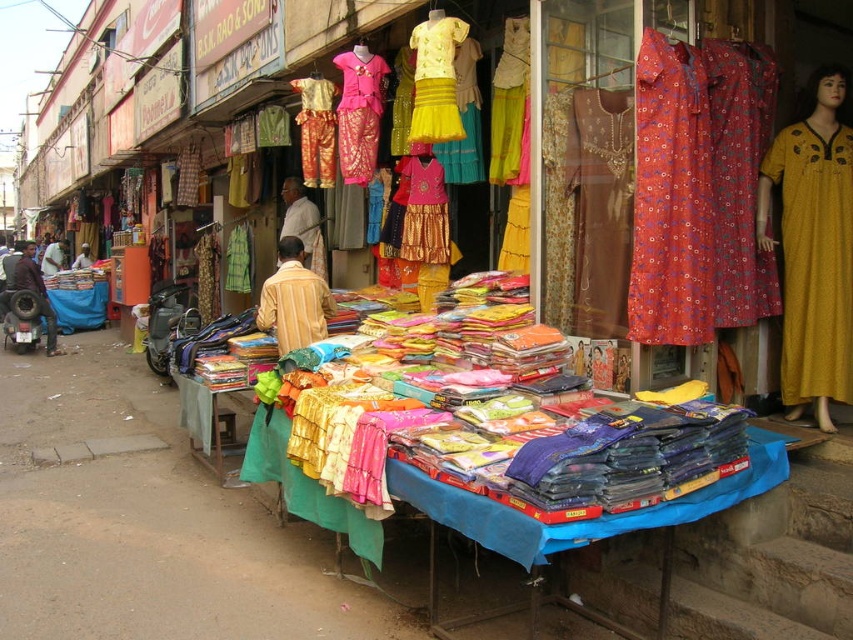
You are a customer in this market and want to pick up both the yellow printed dress at right and the yellow satin dress at center. If you are standing at the entrance of the shop, which dress should you walk towards first to reach the one closer to you?

The yellow satin dress at center is closer to you than the yellow printed dress at right, so you should walk towards the yellow satin dress at center first.

You are a photographer trying to capture the vibrant shop in the scene. You notice two points in the image at coordinates point (350, 64) and point (292, 225). Which point should you focus on to ensure it appears sharper in the photo?

Point (350, 64) is closer to the camera than point (292, 225), so focusing on point (350, 64) will make it appear sharper in the photo.

You are a customer at the market and want to see both the yellow printed dress at right and the yellow satin dress at center. Which dress should you move closer to first to see both?

You should move closer to the yellow printed dress at right first because it is in front of the yellow satin dress at center, so you can see both without needing to move further back.